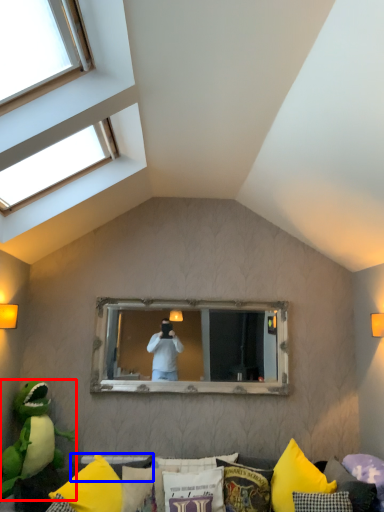
Question: Which object is further to the camera taking this photo, parrot (highlighted by a red box) or pillow (highlighted by a blue box)?

Choices:
 (A) parrot
 (B) pillow

Answer: (B)